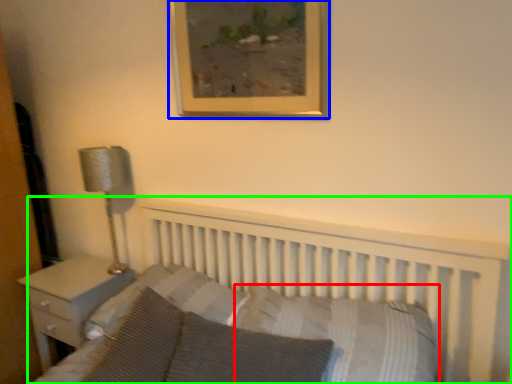
Question: Estimate the real-world distances between objects in this image. Which object is closer to pillow (highlighted by a red box), picture frame (highlighted by a blue box) or bed (highlighted by a green box)?

Choices:
 (A) picture frame
 (B) bed

Answer: (B)